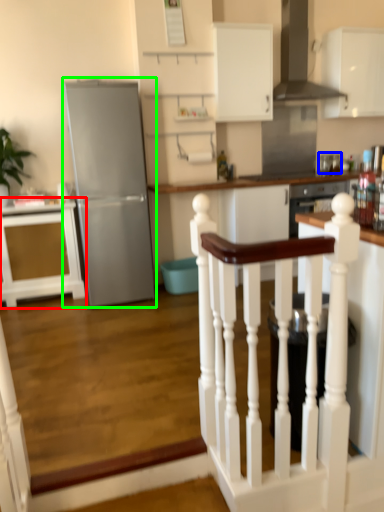
Question: Considering the real-world distances, which object is farthest from cabinetry (highlighted by a red box)? appliance (highlighted by a blue box) or refrigerator (highlighted by a green box)?

Choices:
 (A) appliance
 (B) refrigerator

Answer: (A)